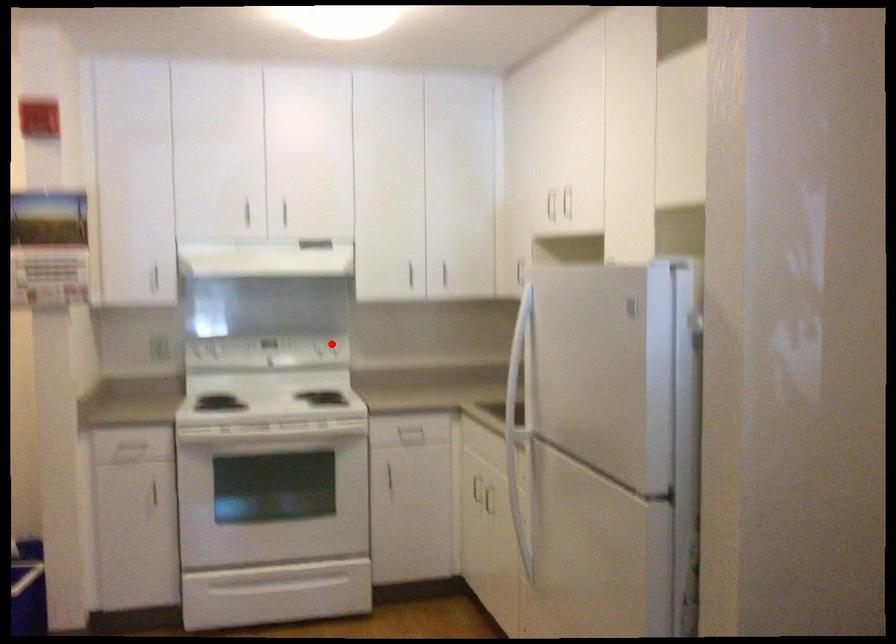
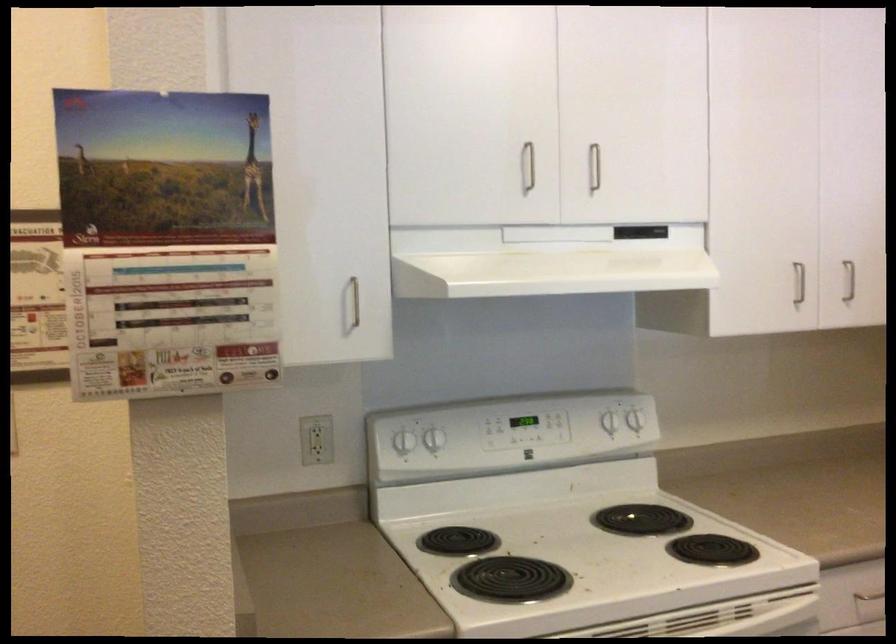
Question: I am providing you with two images of the same scene from different viewpoints. Image1 has a red point marked. In image2, the corresponding 3D location appears at what relative position? Reply with the corresponding letter.

Choices:
 (A) Closer
 (B) Farther

Answer: (A)